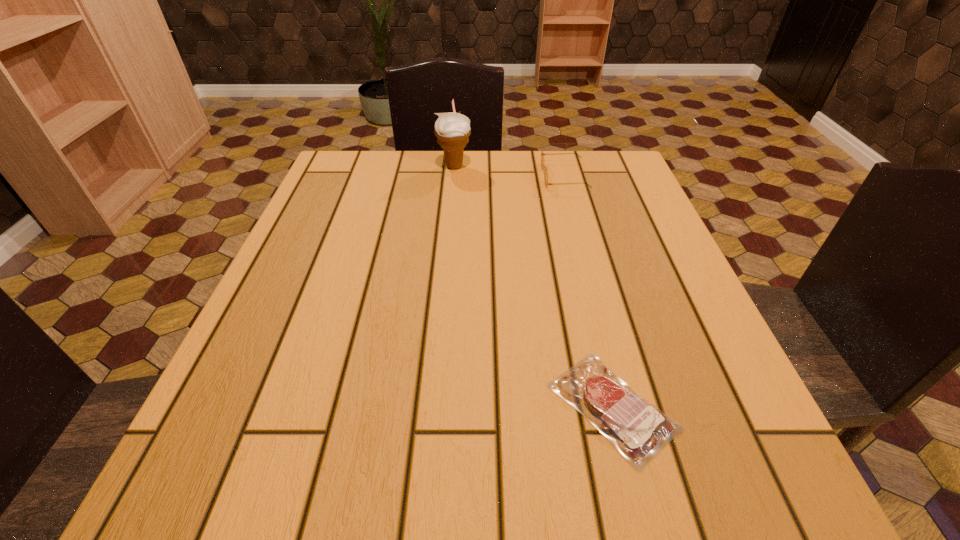
Find the location of a particular element. Image resolution: width=960 pixels, height=540 pixels. icecream situated at the far edge is located at coordinates (453, 130).

Locate an element on the screen. sunglasses that is at the far edge is located at coordinates (544, 168).

Image resolution: width=960 pixels, height=540 pixels. Identify the location of object positioned at the near edge. (642, 430).

In order to click on sunglasses present at the right edge in this screenshot , I will do `click(544, 168)`.

Locate an element on the screen. The width and height of the screenshot is (960, 540). steak that is positioned at the right edge is located at coordinates (642, 430).

The image size is (960, 540). Find the location of `object present at the far right corner`. object present at the far right corner is located at coordinates (544, 168).

At what (x,y) coordinates should I click in order to perform the action: click on object positioned at the near right corner. Please return your answer as a coordinate pair (x, y). Looking at the image, I should click on (642, 430).

Find the location of a particular element. Image resolution: width=960 pixels, height=540 pixels. free space at the far edge of the desktop is located at coordinates (488, 177).

Find the location of a particular element. The image size is (960, 540). free space at the left edge of the desktop is located at coordinates (269, 320).

Image resolution: width=960 pixels, height=540 pixels. I want to click on vacant space at the right edge, so click(x=620, y=272).